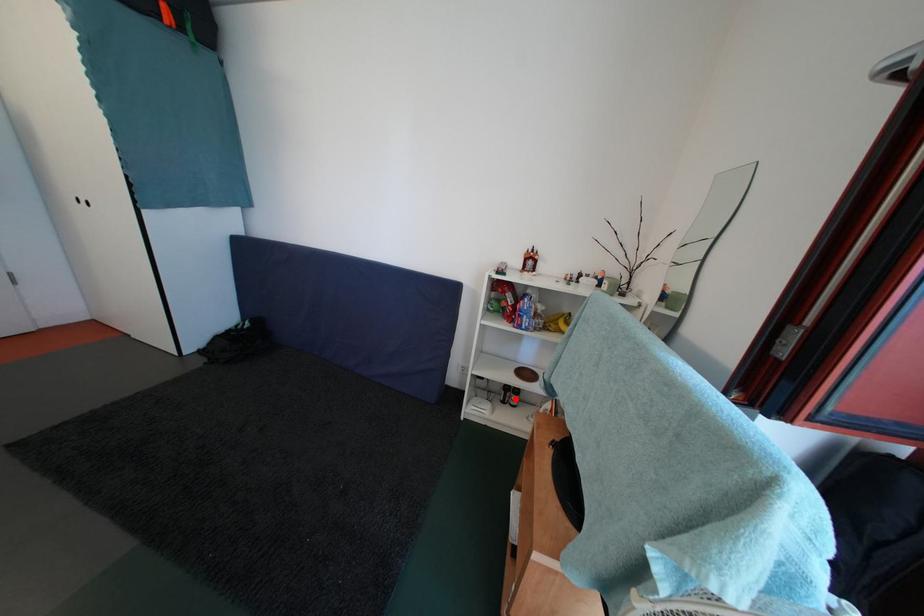
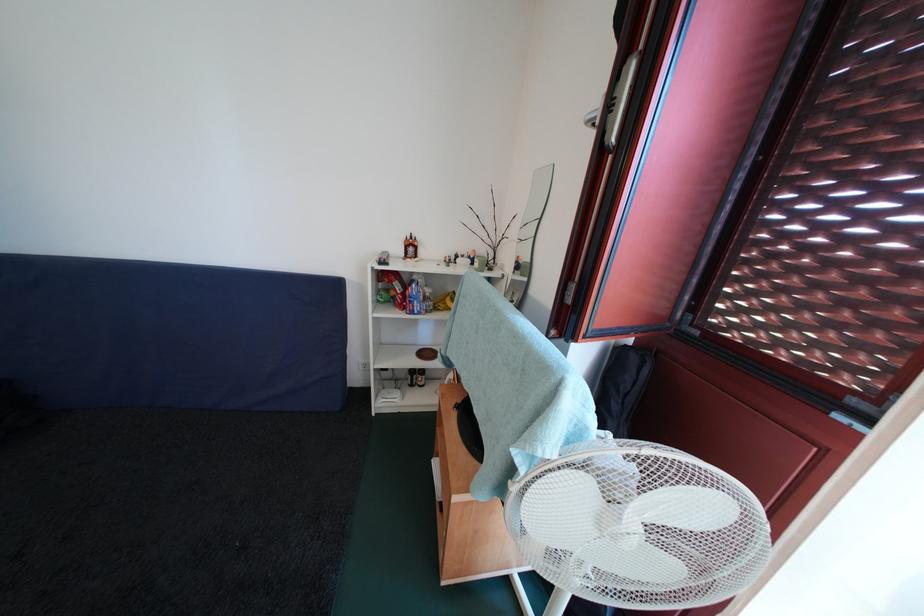
Question: I am providing you with two images of the same scene from different viewpoints. Image1 has a red point marked. In image2, the corresponding 3D location appears at what relative position? Reply with the corresponding letter.

Choices:
 (A) Closer
 (B) Farther

Answer: (B)